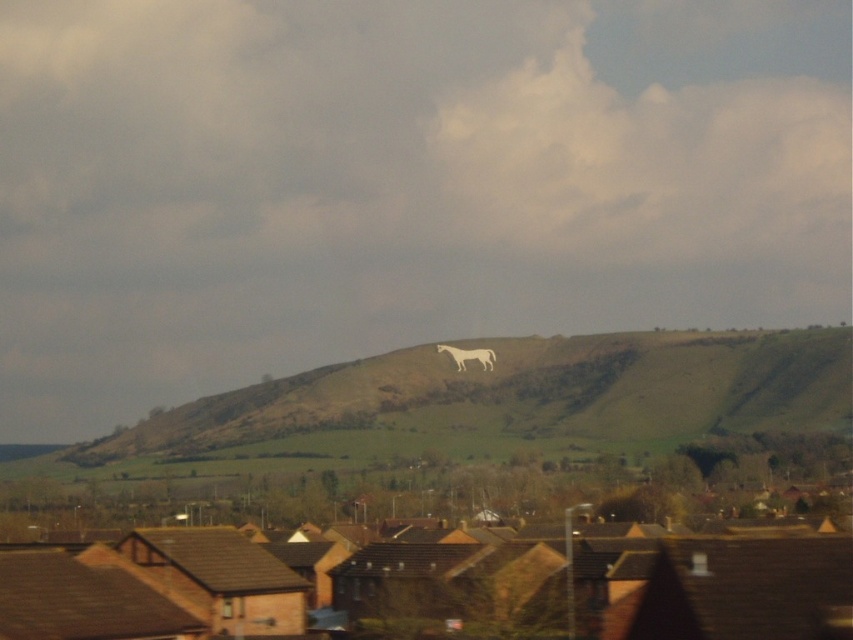
Question: Does cloudy sky at upper center appear on the left side of white stone horse at center?

Choices:
 (A) no
 (B) yes

Answer: (B)

Question: Is cloudy sky at upper center bigger than white stone horse at center?

Choices:
 (A) yes
 (B) no

Answer: (A)

Question: Is cloudy sky at upper center smaller than white stone horse at center?

Choices:
 (A) no
 (B) yes

Answer: (A)

Question: Which point appears farthest from the camera in this image?

Choices:
 (A) (482, 353)
 (B) (706, 237)

Answer: (B)

Question: Which point is closer to the camera?

Choices:
 (A) cloudy sky at upper center
 (B) white stone horse at center

Answer: (B)

Question: Among these points, which one is farthest from the camera?

Choices:
 (A) (390, 100)
 (B) (494, 355)

Answer: (A)